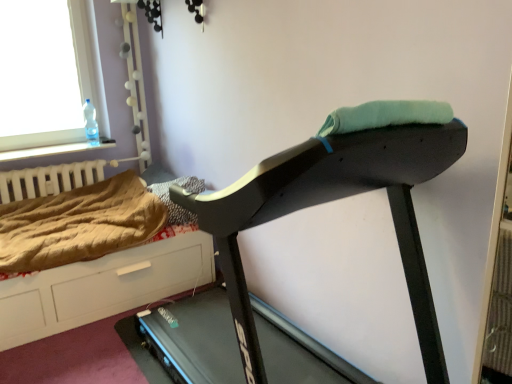
Question: Is brown textured blanket at center, which appears as the first blanket when viewed from the right, not within brown wood dresser at lower left?

Choices:
 (A) yes
 (B) no

Answer: (B)

Question: Can you see brown textured blanket at center, which appears as the first blanket when viewed from the right, touching brown wood dresser at lower left?

Choices:
 (A) no
 (B) yes

Answer: (A)

Question: From a real-world perspective, is brown textured blanket at center, which appears as the first blanket when viewed from the right, on brown wood dresser at lower left?

Choices:
 (A) yes
 (B) no

Answer: (A)

Question: Are brown textured blanket at center, which is the second blanket from left to right, and brown wood dresser at lower left located far from each other?

Choices:
 (A) no
 (B) yes

Answer: (A)

Question: Considering the relative sizes of brown textured blanket at center, which is the second blanket from left to right, and brown wood dresser at lower left in the image provided, is brown textured blanket at center, which is the second blanket from left to right, taller than brown wood dresser at lower left?

Choices:
 (A) no
 (B) yes

Answer: (A)

Question: Is black plastic treadmill at center to the left or to the right of transparent glass window at upper left in the image?

Choices:
 (A) right
 (B) left

Answer: (A)

Question: Is black plastic treadmill at center bigger or smaller than transparent glass window at upper left?

Choices:
 (A) small
 (B) big

Answer: (B)

Question: In terms of height, does black plastic treadmill at center look taller or shorter compared to transparent glass window at upper left?

Choices:
 (A) tall
 (B) short

Answer: (A)

Question: Is black plastic treadmill at center wider or thinner than transparent glass window at upper left?

Choices:
 (A) thin
 (B) wide

Answer: (B)

Question: Is white matte radiator at left inside the boundaries of brown textured blanket at center, which appears as the first blanket when viewed from the right, or outside?

Choices:
 (A) inside
 (B) outside

Answer: (B)

Question: Based on their positions, is white matte radiator at left located to the left or right of brown textured blanket at center, which appears as the first blanket when viewed from the right?

Choices:
 (A) right
 (B) left

Answer: (B)

Question: From a real-world perspective, is white matte radiator at left physically located above or below brown textured blanket at center, which is the second blanket from left to right?

Choices:
 (A) above
 (B) below

Answer: (A)

Question: Is point (82, 173) closer or farther from the camera than point (187, 175)?

Choices:
 (A) farther
 (B) closer

Answer: (A)

Question: In terms of size, does brown textured blanket at center, which appears as the first blanket when viewed from the right, appear bigger or smaller than black plastic treadmill at center?

Choices:
 (A) small
 (B) big

Answer: (A)

Question: From a real-world perspective, is brown textured blanket at center, which appears as the first blanket when viewed from the right, positioned above or below black plastic treadmill at center?

Choices:
 (A) above
 (B) below

Answer: (B)